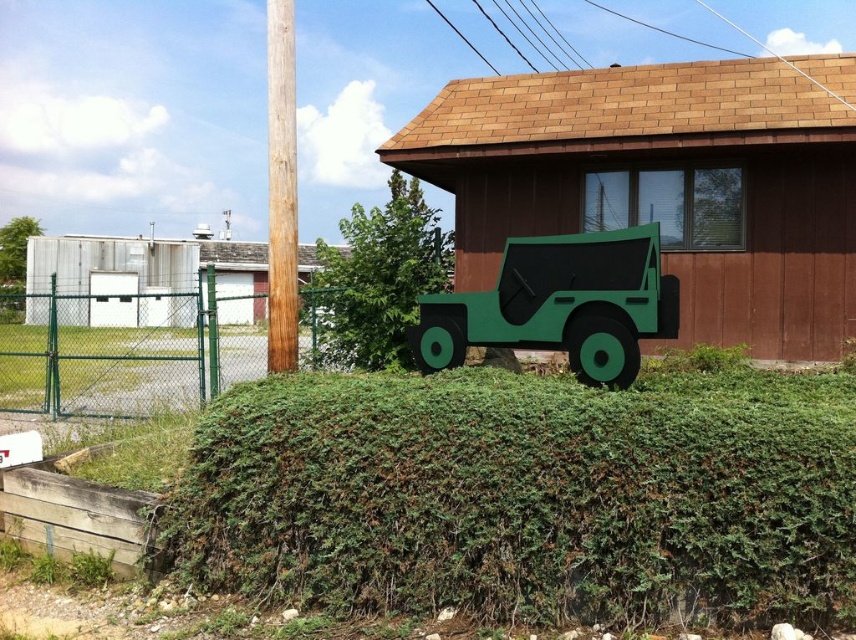
You are standing at the entrance of the wooden building with a brown shingled roof and a large window. You notice a point marked at coordinates (526, 497). Based on the scene description, what object does this point most likely represent?

The point at (526, 497) corresponds to the green leafy hedge at center, as stated in the objects description.

You are standing in front of the wooden building with a brown shingled roof and a large window. There is a green sign shaped like a vintage Jeep in front of the building. You want to place a new bench exactly at the point marked as point (401,496). If the bench requires 3 meters of space in front of it to be safe, is there enough space between the bench and the chain link fence to the left of the building?

The point (401,496) is 4.26 meters from the viewer. Since the bench requires 3 meters of space, there is enough space between the bench and the chain link fence to the left of the building.